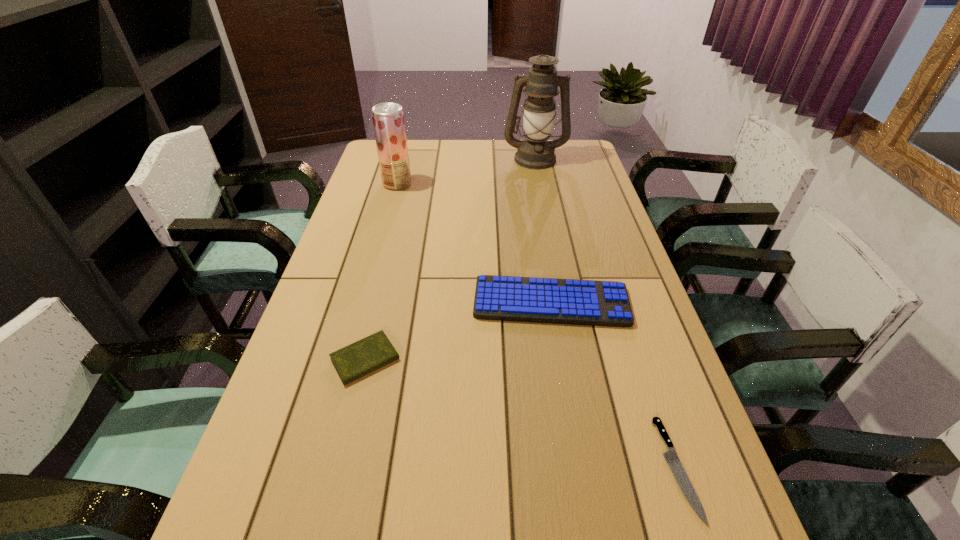
Image resolution: width=960 pixels, height=540 pixels. Identify the location of the tallest object. (535, 152).

The height and width of the screenshot is (540, 960). Identify the location of the farthest object. (535, 152).

The width and height of the screenshot is (960, 540). I want to click on the second farthest object, so click(388, 120).

The width and height of the screenshot is (960, 540). Find the location of `fruit juice`. fruit juice is located at coordinates (388, 120).

Identify the location of the third shortest object. (505, 298).

Where is `the third nearest object`? The width and height of the screenshot is (960, 540). the third nearest object is located at coordinates (505, 298).

Locate an element on the screen. Image resolution: width=960 pixels, height=540 pixels. diary is located at coordinates (358, 359).

At what (x,y) coordinates should I click in order to perform the action: click on the second shortest object. Please return your answer as a coordinate pair (x, y). The image size is (960, 540). Looking at the image, I should click on (358, 359).

Image resolution: width=960 pixels, height=540 pixels. Identify the location of the shortest object. (671, 457).

At what (x,y) coordinates should I click in order to perform the action: click on steak knife. Please return your answer as a coordinate pair (x, y). This screenshot has height=540, width=960. Looking at the image, I should click on (671, 457).